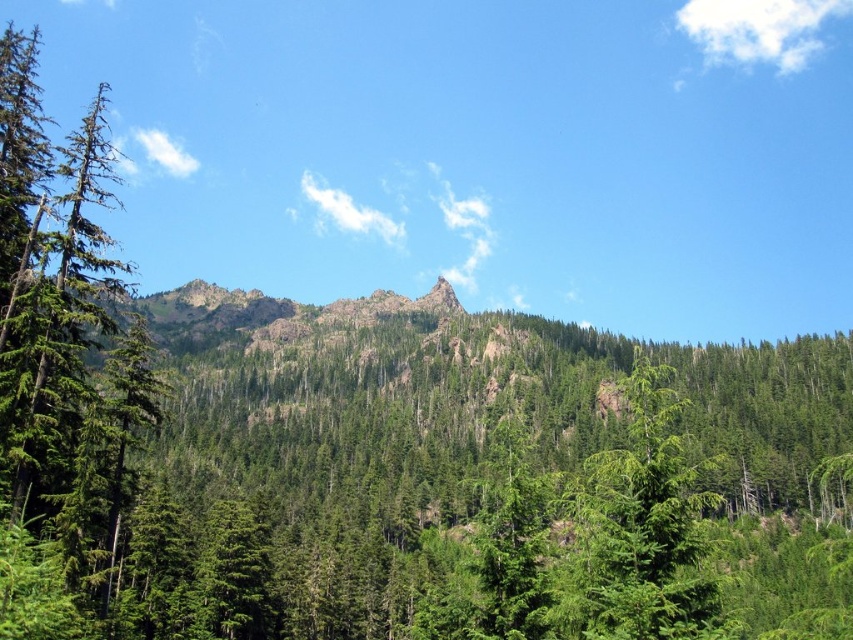
You are a hiker who wants to place a 100 feet long tent between the two points marked as point (112, 496) and another point. Can your tent fit between them without overlapping either point?

The two points marked as point (112, 496) are 181.81 feet apart. Since the tent is 100 feet long, there is enough space between them to place the tent without overlapping either point.

You are hiking through the forest and want to take a photo of both the green matte tree at left and the green matte tree at center. Which tree should you move towards to get both in the frame without having to adjust your camera angle much?

You should move towards the green matte tree at left because it is closer to you than the green matte tree at center, so keeping it in frame while adjusting for distance would be easier.